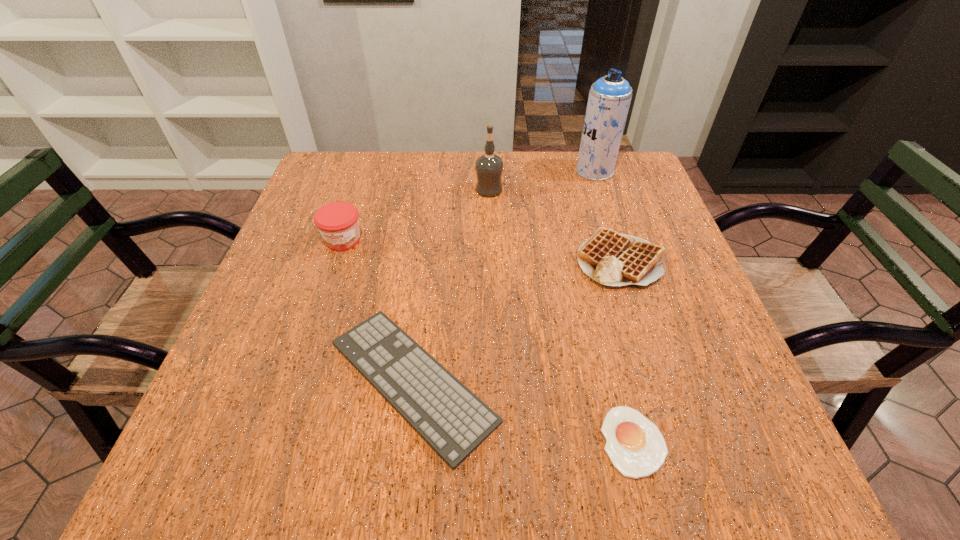
Identify the location of vacant region at the far left corner. (341, 173).

The image size is (960, 540). What are the coordinates of `free spot at the near left corner of the desktop` in the screenshot? It's located at (285, 453).

Locate an element on the screen. vacant point at the far right corner is located at coordinates (614, 173).

Image resolution: width=960 pixels, height=540 pixels. What are the coordinates of `vacant space at the near right corner of the desktop` in the screenshot? It's located at (723, 480).

Locate an element on the screen. vacant space that is in between the computer keyboard and the fourth tallest object is located at coordinates (516, 320).

The width and height of the screenshot is (960, 540). Identify the location of free space that is in between the jam and the farthest object. pos(468,206).

Locate an element on the screen. free space between the waffle and the second shortest object is located at coordinates (516, 320).

Image resolution: width=960 pixels, height=540 pixels. What are the coordinates of `vacant area that lies between the shortest object and the second shortest object` in the screenshot? It's located at (523, 411).

The width and height of the screenshot is (960, 540). Find the location of `blank region between the aerosol can and the egg yolk`. blank region between the aerosol can and the egg yolk is located at coordinates (613, 306).

Where is `vacant point located between the aerosol can and the shortest object`? vacant point located between the aerosol can and the shortest object is located at coordinates (613, 306).